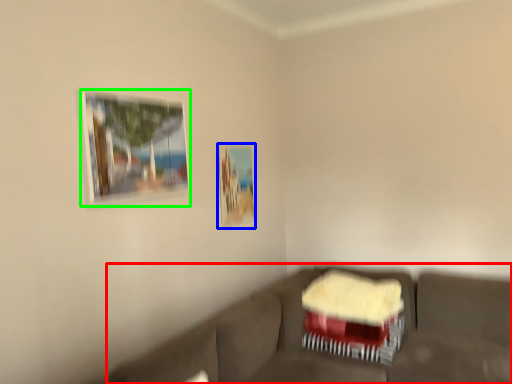
Question: Which object is the farthest from studio couch (highlighted by a red box)? Choose among these: picture frame (highlighted by a blue box) or picture frame (highlighted by a green box).

Choices:
 (A) picture frame
 (B) picture frame

Answer: (B)